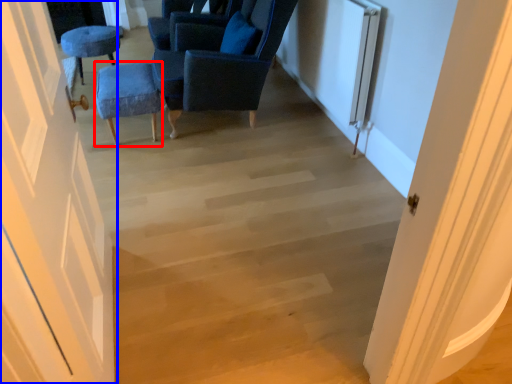
Question: Which object appears closest to the camera in this image, furniture (highlighted by a red box) or door (highlighted by a blue box)?

Choices:
 (A) furniture
 (B) door

Answer: (B)